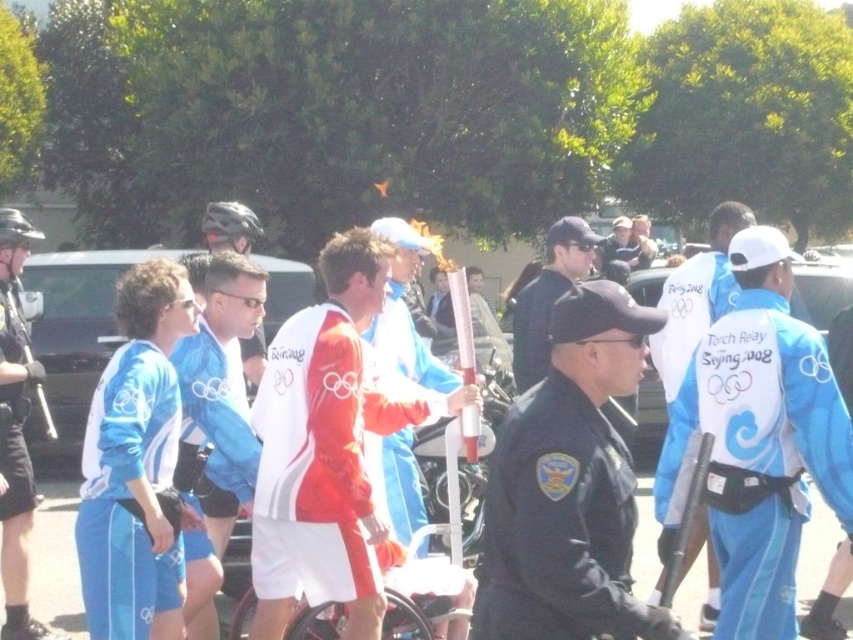
Question: Based on their relative distances, which object is farther from the black uniform at center?

Choices:
 (A) white fabric jacket at center
 (B) light blue fabric jacket at center

Answer: (B)

Question: Does blue fabric jacket at center have a greater width compared to blue fabric jacket at left?

Choices:
 (A) yes
 (B) no

Answer: (A)

Question: Which object is the closest to the dark blue uniform at center?

Choices:
 (A) light blue fabric jacket at center
 (B) blue fabric jacket at left

Answer: (A)

Question: Does white fabric jacket at center have a greater width compared to light blue fabric jacket at center?

Choices:
 (A) yes
 (B) no

Answer: (A)

Question: Does blue fabric jacket at center come in front of light blue fabric jacket at center?

Choices:
 (A) no
 (B) yes

Answer: (B)

Question: Considering the real-world distances, which object is closest to the light blue fabric jacket at center?

Choices:
 (A) white fabric jacket at center
 (B) blue fabric jacket at center
 (C) blue fabric jacket at left

Answer: (A)